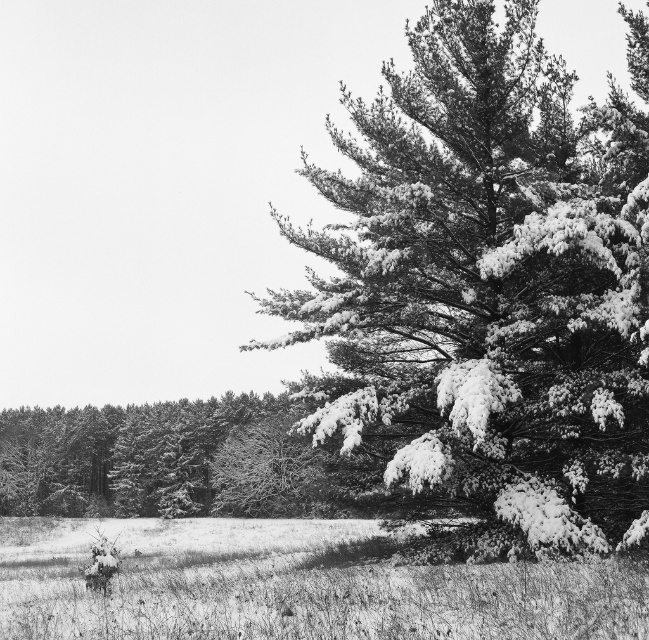
Question: Estimate the real-world distances between objects in this image. Which object is closer to the snowy grass at lower center?

Choices:
 (A) snow-covered pine tree at right
 (B) snow-covered pine tree at center

Answer: (A)

Question: Considering the real-world distances, which object is closest to the snow-covered pine tree at right?

Choices:
 (A) snow-covered pine tree at center
 (B) snowy grass at lower center

Answer: (B)

Question: Which point is closer to the camera?

Choices:
 (A) (556, 436)
 (B) (276, 476)

Answer: (A)

Question: Is snowy grass at lower center wider than snow-covered pine tree at center?

Choices:
 (A) no
 (B) yes

Answer: (A)

Question: Observing the image, what is the correct spatial positioning of snow-covered pine tree at right in reference to snowy grass at lower center?

Choices:
 (A) below
 (B) above

Answer: (B)

Question: From the image, what is the correct spatial relationship of snow-covered pine tree at right in relation to snowy grass at lower center?

Choices:
 (A) left
 (B) right

Answer: (B)